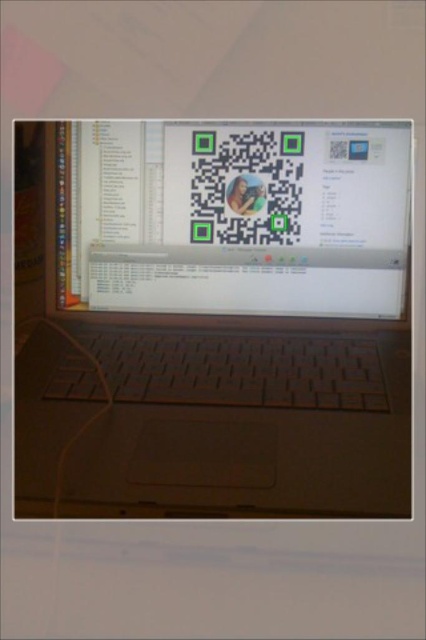
Is point (385, 428) positioned after point (180, 282)?

No, it is not.

Does satin silver laptop at center have a greater height compared to white glossy qr code at center?

Yes.

The width and height of the screenshot is (426, 640). I want to click on satin silver laptop at center, so click(213, 317).